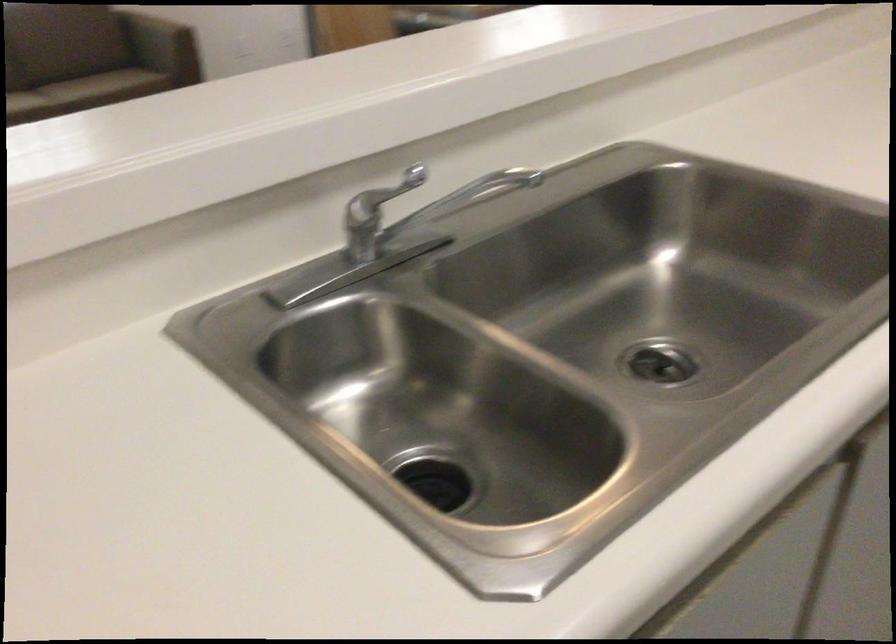
The image size is (896, 644). Identify the location of sofa armrest. (161, 39).